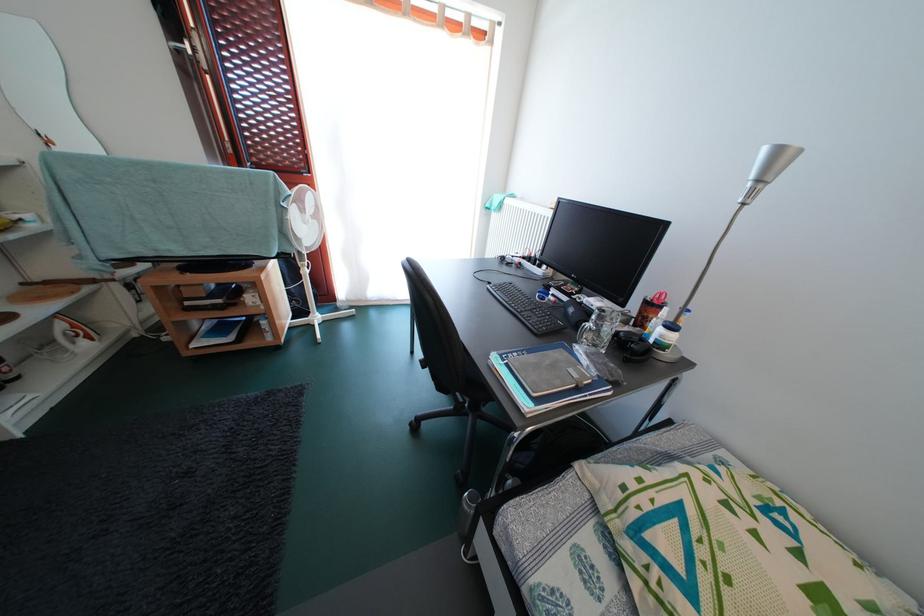
Where would you adjust the silver lamp head? Please return your answer as a coordinate pair (x, y).

(772, 164)